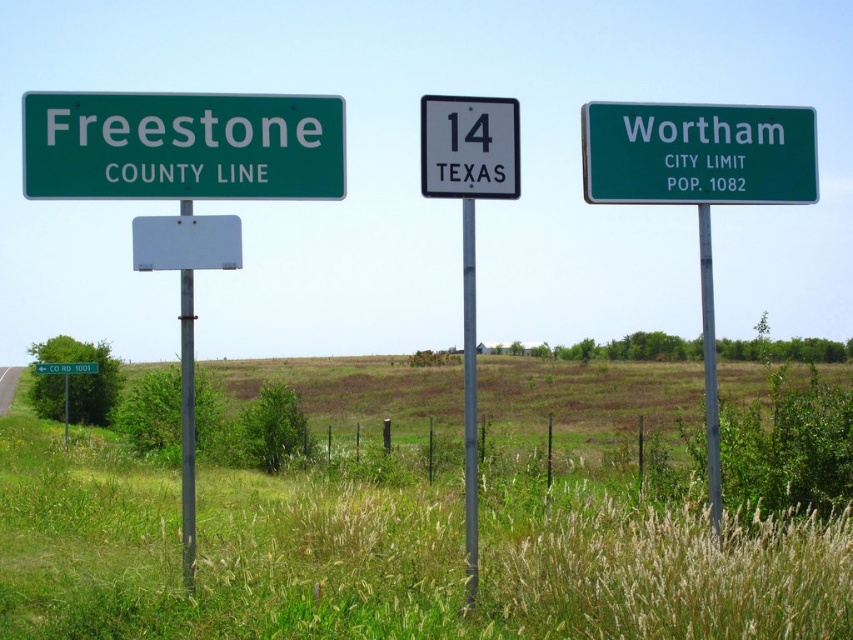
You are driving along a rural road and see two signs at the center of the image. The metallic gray sign at center and the green plastic sign at center. Which one is located to the right of the other?

The metallic gray sign at center is positioned on the right side of green plastic sign at center.